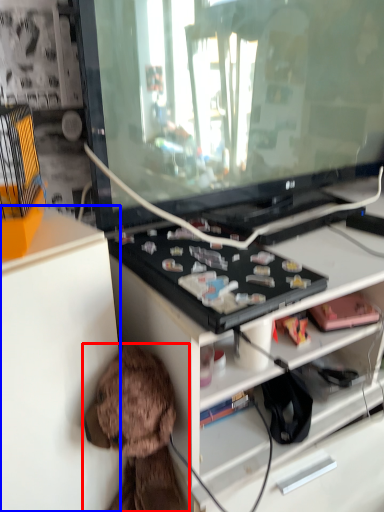
Question: Which object appears farthest to the camera in this image, toy (highlighted by a red box) or cabinetry (highlighted by a blue box)?

Choices:
 (A) toy
 (B) cabinetry

Answer: (A)